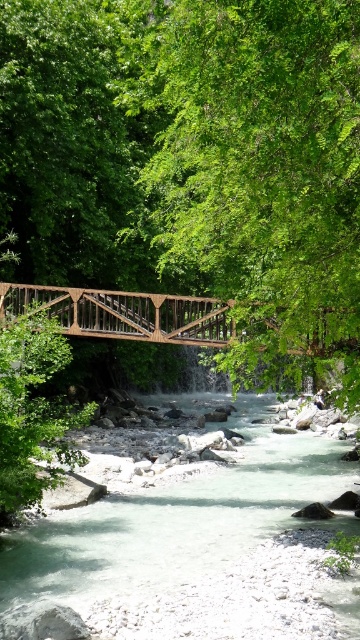
You are standing at the wooden bridge at the center of the scene. Looking towards the point marked as point [258,172], what do you see in that direction?

In the direction of point [258,172], you see a green leafy tree at center.

You are a hiker planning to cross the wooden bridge at the center of the scene. You need to know the distance between the green leafy tree at center and the white smooth river at center to ensure your path is safe. Is the distance sufficient for you to walk comfortably between them?

The distance between the green leafy tree at center and the white smooth river at center is 19.11 feet, which is more than enough for a hiker to walk comfortably between them.